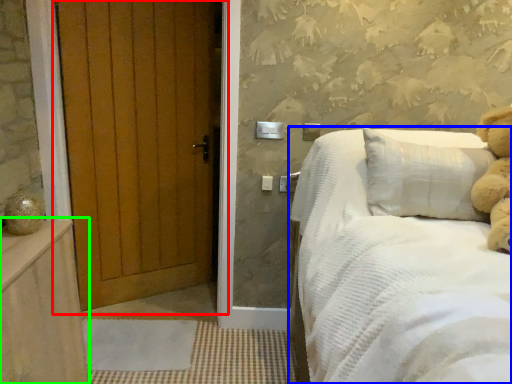
Question: Considering the real-world distances, which object is farthest from door (highlighted by a red box)? bed (highlighted by a blue box) or balustrade (highlighted by a green box)?

Choices:
 (A) bed
 (B) balustrade

Answer: (A)